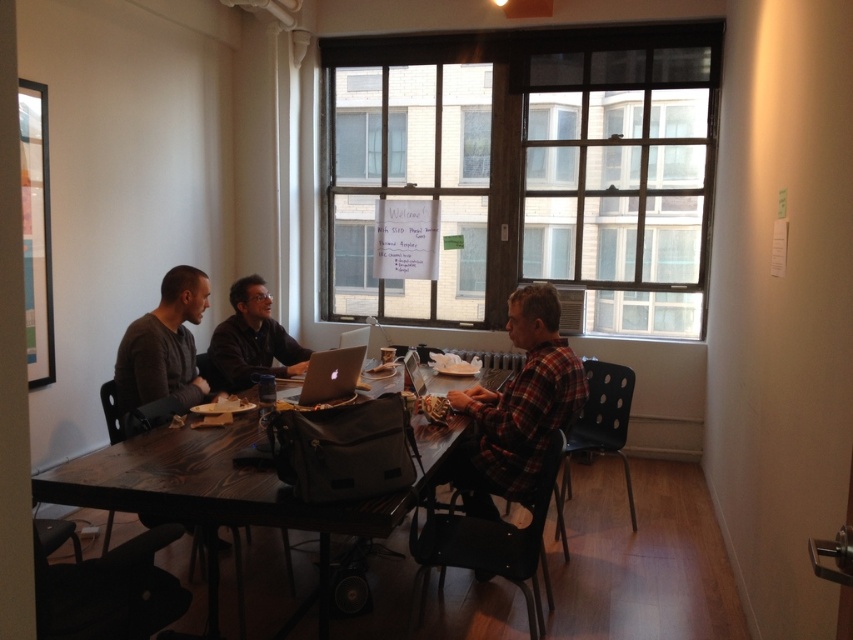
Question: Considering the real-world distances, which object is farthest from the dark gray sweater at center?

Choices:
 (A) dark wood table at center
 (B) black glass window at upper center
 (C) whiteboard at upper center
 (D) plaid fabric shirt at center

Answer: (B)

Question: Can you confirm if black glass window at upper center is positioned to the left of whiteboard at upper center?

Choices:
 (A) no
 (B) yes

Answer: (A)

Question: Is whiteboard at upper center to the right of silver metallic laptop at center from the viewer's perspective?

Choices:
 (A) yes
 (B) no

Answer: (B)

Question: Which of the following is the farthest from the observer?

Choices:
 (A) (392, 529)
 (B) (161, 340)

Answer: (B)

Question: Is dark wood table at center thinner than dark gray sweater at left?

Choices:
 (A) yes
 (B) no

Answer: (B)

Question: Based on their relative distances, which object is nearer to the plaid fabric shirt at center?

Choices:
 (A) black glass window at upper center
 (B) dark gray sweater at center

Answer: (B)